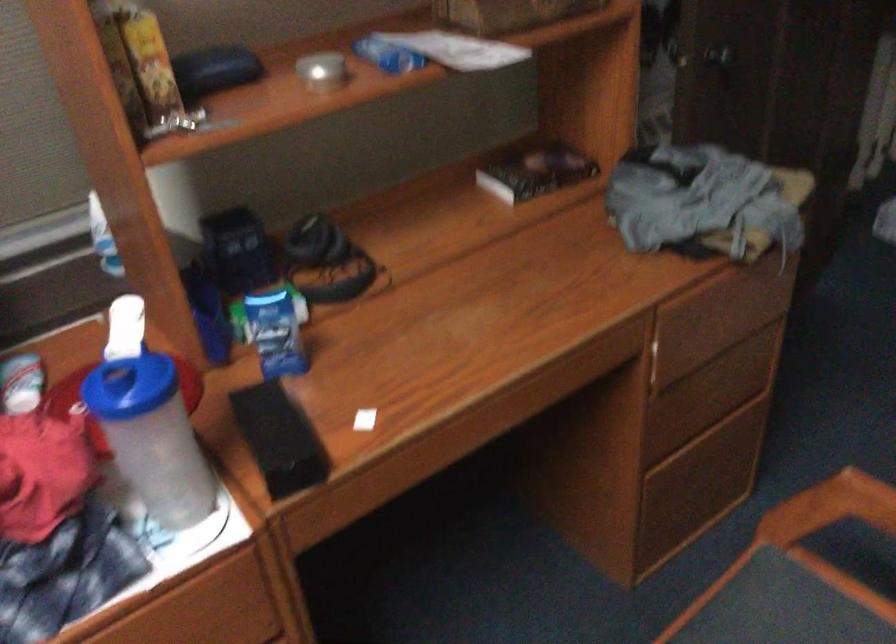
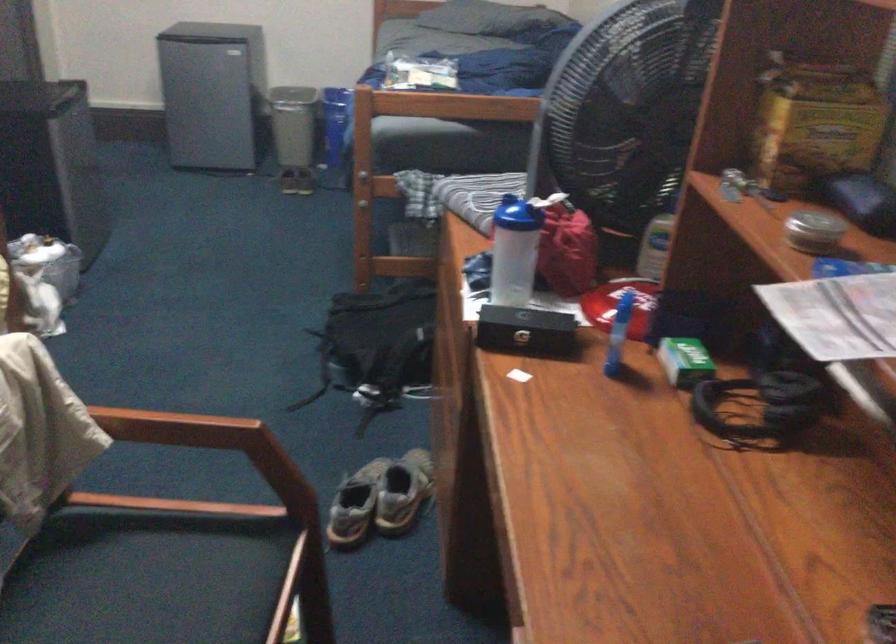
Locate, in the second image, the point that corresponds to point (268, 305) in the first image.

(685, 361)